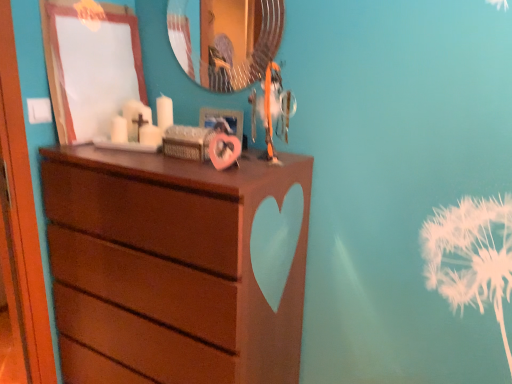
The image size is (512, 384). Identify the location of teal glossy mirror at upper center. (225, 40).

Does matte white picture frame at upper left, acting as the 2th picture frame starting from the right, turn towards matte brown dresser at center?

No, matte white picture frame at upper left, acting as the 2th picture frame starting from the right, is not aimed at matte brown dresser at center.

From a real-world perspective, is matte white picture frame at upper left, acting as the 2th picture frame starting from the right, beneath matte brown dresser at center?

No, from a real-world perspective, matte white picture frame at upper left, acting as the 2th picture frame starting from the right, is not below matte brown dresser at center.

This screenshot has height=384, width=512. I want to click on the chest of drawers in front of the matte white picture frame at upper left, acting as the 2th picture frame starting from the right, so pyautogui.click(x=178, y=259).

Is matte white picture frame at upper left, acting as the 2th picture frame starting from the right, thinner than matte brown dresser at center?

Yes.

Is matte white picture frame at upper left, positioned as the first picture frame in left-to-right order, oriented towards metallic silver picture frame at upper center, the 2th picture frame in the left-to-right sequence?

Yes.

Between matte white picture frame at upper left, positioned as the first picture frame in left-to-right order, and metallic silver picture frame at upper center, the 2th picture frame in the left-to-right sequence, which one has less height?

metallic silver picture frame at upper center, the 2th picture frame in the left-to-right sequence.

The height and width of the screenshot is (384, 512). In order to click on picture frame lying below the matte white picture frame at upper left, positioned as the first picture frame in left-to-right order (from the image's perspective) in this screenshot , I will do `click(223, 117)`.

Is metallic silver picture frame at upper center, the 2th picture frame in the left-to-right sequence, bigger or smaller than matte white picture frame at upper left, positioned as the first picture frame in left-to-right order?

metallic silver picture frame at upper center, the 2th picture frame in the left-to-right sequence, is smaller than matte white picture frame at upper left, positioned as the first picture frame in left-to-right order.

Does metallic silver picture frame at upper center, the 2th picture frame in the left-to-right sequence, appear on the right side of matte white picture frame at upper left, positioned as the first picture frame in left-to-right order?

Correct, you'll find metallic silver picture frame at upper center, the 2th picture frame in the left-to-right sequence, to the right of matte white picture frame at upper left, positioned as the first picture frame in left-to-right order.

Is point (234, 121) closer to viewer compared to point (122, 12)?

Yes.

Which is in front, metallic silver picture frame at upper center, which is the first picture frame from right to left, or matte white picture frame at upper left, positioned as the first picture frame in left-to-right order?

matte white picture frame at upper left, positioned as the first picture frame in left-to-right order, is closer to the camera.

From a real-world perspective, between matte brown dresser at center and teal glossy mirror at upper center, who is vertically lower?

matte brown dresser at center.

How many degrees apart are the facing directions of matte brown dresser at center and teal glossy mirror at upper center?

0.425 degrees separate the facing orientations of matte brown dresser at center and teal glossy mirror at upper center.

Considering the relative sizes of matte brown dresser at center and teal glossy mirror at upper center in the image provided, is matte brown dresser at center smaller than teal glossy mirror at upper center?

Actually, matte brown dresser at center might be larger than teal glossy mirror at upper center.

Considering the points (244, 84) and (241, 123), which point is in front, point (244, 84) or point (241, 123)?

The point (241, 123) is more forward.

Is teal glossy mirror at upper center at the left side of metallic silver picture frame at upper center, the 2th picture frame in the left-to-right sequence?

Indeed, teal glossy mirror at upper center is positioned on the left side of metallic silver picture frame at upper center, the 2th picture frame in the left-to-right sequence.

I want to click on mirror lying above the metallic silver picture frame at upper center, the 2th picture frame in the left-to-right sequence (from the image's perspective), so click(225, 40).

From a real-world perspective, is teal glossy mirror at upper center located higher than metallic silver picture frame at upper center, which is the first picture frame from right to left?

Correct, in the physical world, teal glossy mirror at upper center is higher than metallic silver picture frame at upper center, which is the first picture frame from right to left.

Is matte brown dresser at center inside metallic silver picture frame at upper center, the 2th picture frame in the left-to-right sequence?

No, matte brown dresser at center is located outside of metallic silver picture frame at upper center, the 2th picture frame in the left-to-right sequence.

Does point (233, 123) come behind point (88, 223)?

Yes, point (233, 123) is behind point (88, 223).

Is metallic silver picture frame at upper center, which is the first picture frame from right to left, to the right of matte brown dresser at center from the viewer's perspective?

Indeed, metallic silver picture frame at upper center, which is the first picture frame from right to left, is positioned on the right side of matte brown dresser at center.

Which of these two, metallic silver picture frame at upper center, the 2th picture frame in the left-to-right sequence, or matte brown dresser at center, is wider?

With larger width is matte brown dresser at center.

There is a teal glossy mirror at upper center. At what (x,y) coordinates should I click in order to perform the action: click on the 2nd picture frame below it (from a real-world perspective). Please return your answer as a coordinate pair (x, y). Image resolution: width=512 pixels, height=384 pixels. Looking at the image, I should click on (223, 117).

From their relative heights in the image, would you say metallic silver picture frame at upper center, which is the first picture frame from right to left, is taller or shorter than teal glossy mirror at upper center?

Considering their sizes, metallic silver picture frame at upper center, which is the first picture frame from right to left, has less height than teal glossy mirror at upper center.

Between metallic silver picture frame at upper center, which is the first picture frame from right to left, and teal glossy mirror at upper center, which one has smaller size?

Smaller between the two is metallic silver picture frame at upper center, which is the first picture frame from right to left.

The height and width of the screenshot is (384, 512). In the image, there is a matte white picture frame at upper left, acting as the 2th picture frame starting from the right. What are the coordinates of `the chest of drawers below it (from a real-world perspective)` in the screenshot? It's located at (178, 259).

I want to click on picture frame that is on the right side of matte white picture frame at upper left, acting as the 2th picture frame starting from the right, so click(223, 117).

Based on their spatial positions, is matte white picture frame at upper left, acting as the 2th picture frame starting from the right, or matte brown dresser at center closer to teal glossy mirror at upper center?

matte white picture frame at upper left, acting as the 2th picture frame starting from the right, is positioned closer to the anchor teal glossy mirror at upper center.

Estimate the real-world distances between objects in this image. Which object is further from metallic silver picture frame at upper center, which is the first picture frame from right to left, matte brown dresser at center or teal glossy mirror at upper center?

matte brown dresser at center.

Considering their positions, is matte brown dresser at center positioned closer to metallic silver picture frame at upper center, the 2th picture frame in the left-to-right sequence, than matte white picture frame at upper left, positioned as the first picture frame in left-to-right order?

matte white picture frame at upper left, positioned as the first picture frame in left-to-right order, lies closer to metallic silver picture frame at upper center, the 2th picture frame in the left-to-right sequence, than the other object.

Estimate the real-world distances between objects in this image. Which object is further from metallic silver picture frame at upper center, which is the first picture frame from right to left, matte white picture frame at upper left, positioned as the first picture frame in left-to-right order, or teal glossy mirror at upper center?

Based on the image, matte white picture frame at upper left, positioned as the first picture frame in left-to-right order, appears to be further to metallic silver picture frame at upper center, which is the first picture frame from right to left.

Based on their spatial positions, is teal glossy mirror at upper center or metallic silver picture frame at upper center, the 2th picture frame in the left-to-right sequence, further from matte white picture frame at upper left, acting as the 2th picture frame starting from the right?

metallic silver picture frame at upper center, the 2th picture frame in the left-to-right sequence, lies further to matte white picture frame at upper left, acting as the 2th picture frame starting from the right, than the other object.

Which object lies nearer to the anchor point matte white picture frame at upper left, positioned as the first picture frame in left-to-right order, metallic silver picture frame at upper center, the 2th picture frame in the left-to-right sequence, or teal glossy mirror at upper center?

teal glossy mirror at upper center is closer to matte white picture frame at upper left, positioned as the first picture frame in left-to-right order.

Looking at the image, which one is located closer to matte brown dresser at center, teal glossy mirror at upper center or matte white picture frame at upper left, acting as the 2th picture frame starting from the right?

matte white picture frame at upper left, acting as the 2th picture frame starting from the right.

Considering their positions, is matte white picture frame at upper left, acting as the 2th picture frame starting from the right, positioned further to metallic silver picture frame at upper center, the 2th picture frame in the left-to-right sequence, than matte brown dresser at center?

matte brown dresser at center is further to metallic silver picture frame at upper center, the 2th picture frame in the left-to-right sequence.

Where is `mirror between matte white picture frame at upper left, positioned as the first picture frame in left-to-right order, and metallic silver picture frame at upper center, which is the first picture frame from right to left`? mirror between matte white picture frame at upper left, positioned as the first picture frame in left-to-right order, and metallic silver picture frame at upper center, which is the first picture frame from right to left is located at coordinates (225, 40).

Where is `picture frame between matte white picture frame at upper left, positioned as the first picture frame in left-to-right order, and matte brown dresser at center in the up-down direction`? The image size is (512, 384). picture frame between matte white picture frame at upper left, positioned as the first picture frame in left-to-right order, and matte brown dresser at center in the up-down direction is located at coordinates (223, 117).